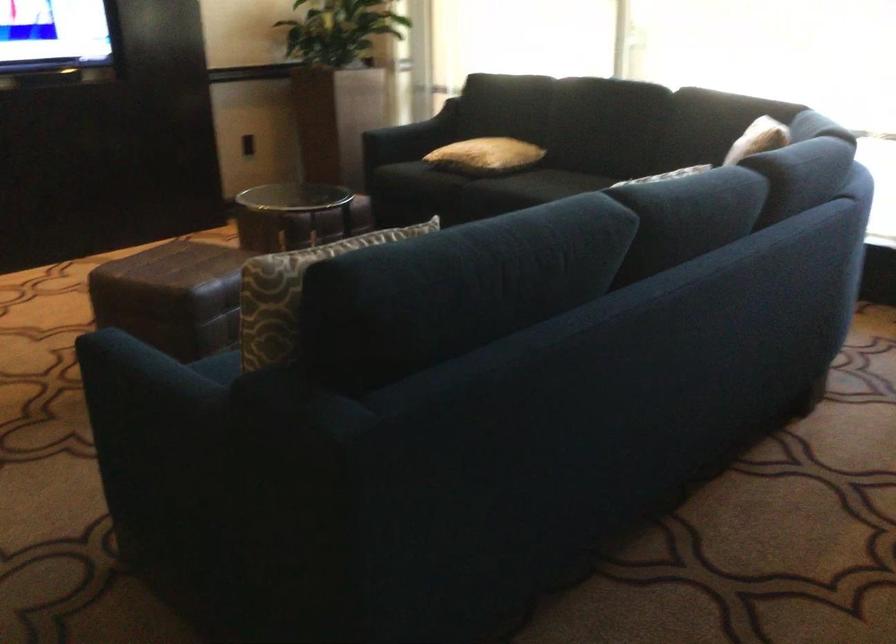
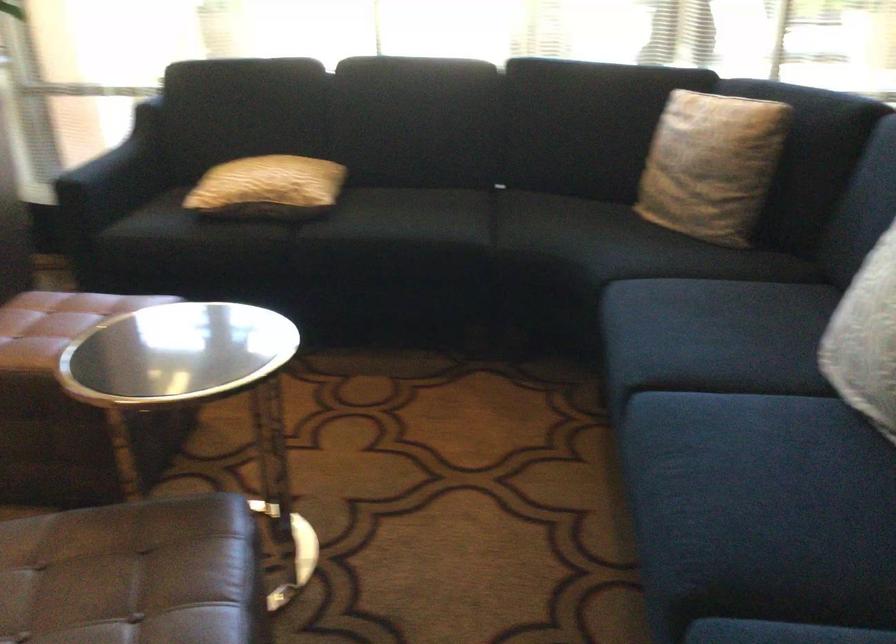
Find the pixel in the second image that matches point (467, 153) in the first image.

(268, 187)